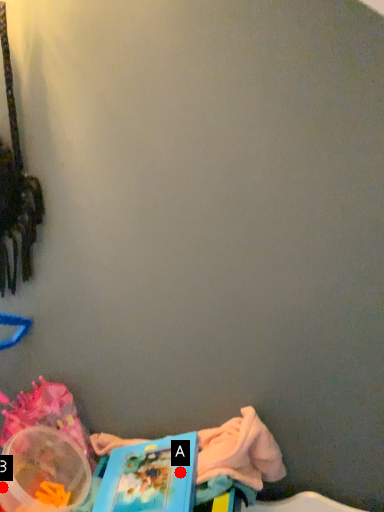
Question: Two points are circled on the image, labeled by A and B beside each circle. Which point is farther to the camera?

Choices:
 (A) A is further
 (B) B is further

Answer: (A)